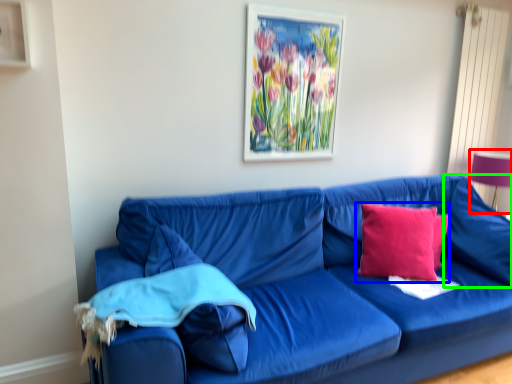
Question: Considering the real-world distances, which object is closest to table lamp (highlighted by a red box)? pillow (highlighted by a blue box) or pillow (highlighted by a green box).

Choices:
 (A) pillow
 (B) pillow

Answer: (B)